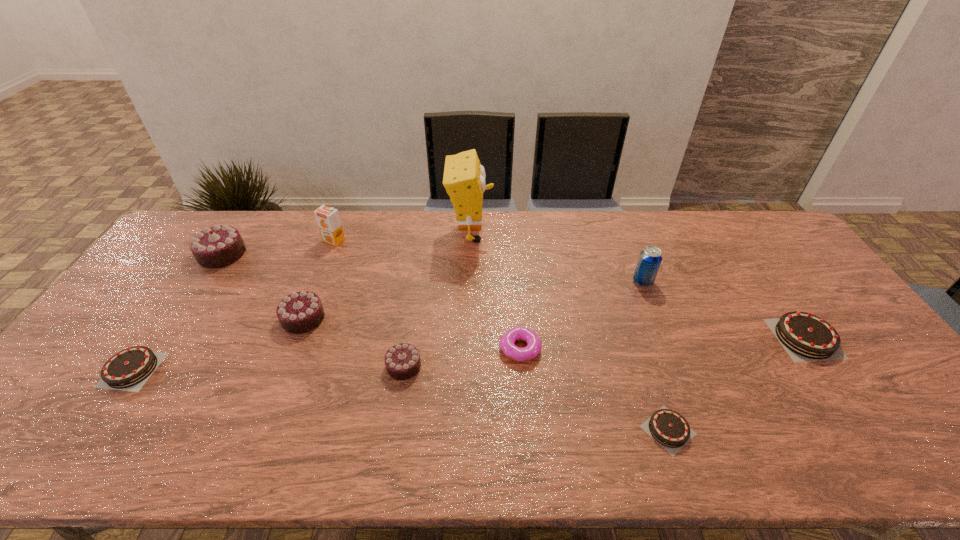
Locate an element on the screen. free space between the fifth tallest chocolate cake and the seventh object from left to right is located at coordinates (326, 359).

The width and height of the screenshot is (960, 540). In order to click on vacant area between the fifth tallest chocolate cake and the farthest chocolate cake in this screenshot , I will do `click(178, 312)`.

Locate an element on the screen. free spot between the beer can and the nearest chocolate chocolate cake is located at coordinates (523, 323).

The width and height of the screenshot is (960, 540). I want to click on free space between the fourth farthest object and the leftmost brown chocolate cake, so click(x=388, y=326).

Image resolution: width=960 pixels, height=540 pixels. I want to click on vacant area that lies between the beer can and the doughnut, so click(x=582, y=315).

Find the location of `free spot between the rightmost object and the tallest object`. free spot between the rightmost object and the tallest object is located at coordinates (637, 286).

At what (x,y) coordinates should I click in order to perform the action: click on free space between the blue beer can and the shortest object. Please return your answer as a coordinate pair (x, y). This screenshot has width=960, height=540. Looking at the image, I should click on (656, 356).

Identify the location of free spot between the rightmost brown chocolate cake and the leftmost chocolate chocolate cake. (514, 296).

Where is `free point between the fourth object from right to left and the third chocolate cake from right to left`? free point between the fourth object from right to left and the third chocolate cake from right to left is located at coordinates pyautogui.click(x=462, y=357).

At what (x,y) coordinates should I click in order to perform the action: click on object identified as the sixth closest to the tallest object. Please return your answer as a coordinate pair (x, y). The width and height of the screenshot is (960, 540). Looking at the image, I should click on (668, 428).